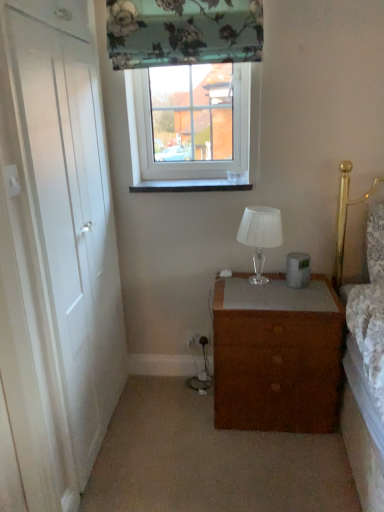
Locate an element on the screen. vacant space underneath white glass lamp at center (from a real-world perspective) is located at coordinates (255, 278).